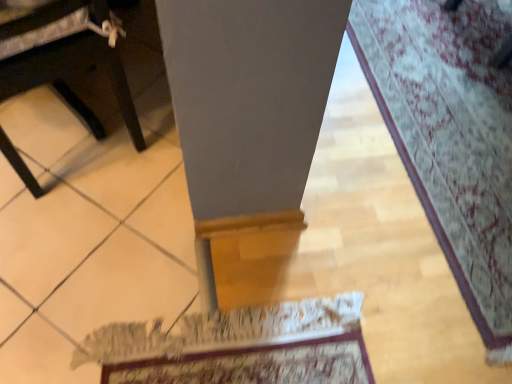
Question: Considering the positions of black plastic table at lower left and patterned carpet at lower right in the image, is black plastic table at lower left taller or shorter than patterned carpet at lower right?

Choices:
 (A) short
 (B) tall

Answer: (B)

Question: Is black plastic table at lower left situated inside patterned carpet at lower right or outside?

Choices:
 (A) inside
 (B) outside

Answer: (B)

Question: Considering their positions, is black plastic table at lower left located in front of or behind patterned carpet at lower right?

Choices:
 (A) front
 (B) behind

Answer: (A)

Question: Is patterned carpet at lower right wider or thinner than black plastic table at lower left?

Choices:
 (A) thin
 (B) wide

Answer: (B)

Question: Is patterned carpet at lower right to the left or to the right of black plastic table at lower left in the image?

Choices:
 (A) right
 (B) left

Answer: (A)

Question: From the image's perspective, is patterned carpet at lower right above or below black plastic table at lower left?

Choices:
 (A) below
 (B) above

Answer: (A)

Question: Considering their positions, is patterned carpet at lower right located in front of or behind black plastic table at lower left?

Choices:
 (A) behind
 (B) front

Answer: (A)